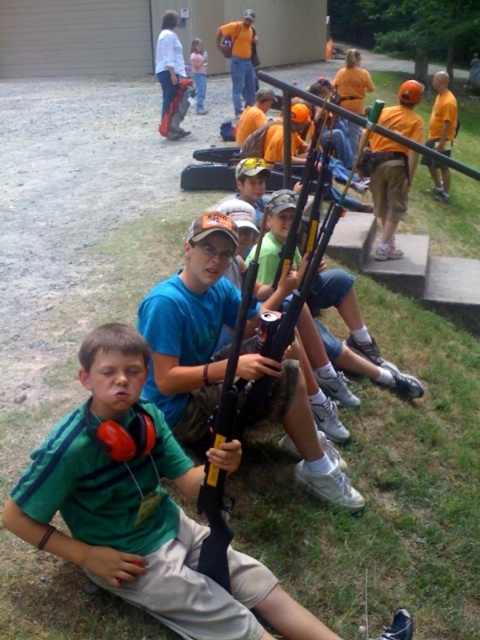
You are a photographer trying to capture a photo of the orange safety vest at center without including the green matte shirt at lower left. Based on their positions, is this possible?

The green matte shirt at lower left is located below orange safety vest at center, so if you position the camera to focus on the orange safety vest at center and avoid the lower part of the frame, it should be possible to exclude the green matte shirt at lower left.

You are standing in the scene and want to place a small flag exactly halfway between point (38, 500) and point (200, 65). Will the flag be closer to the camera than both points?

The flag placed halfway between point (38, 500) and point (200, 65) would be closer to the camera than point (200, 65) but farther than point 0.783. Since the question asks if it is closer than both, the answer is no.

You are a safety officer at a shooting range. You need to ensure that the green matte shirt at lower left and the orange safety vest at center are at least 15 meters apart for safety regulations. Based on the scene, are they compliant?

The green matte shirt at lower left and orange safety vest at center are 14.24 meters apart from each other, which is less than the required 15 meters. Therefore, they are not compliant with safety regulations.